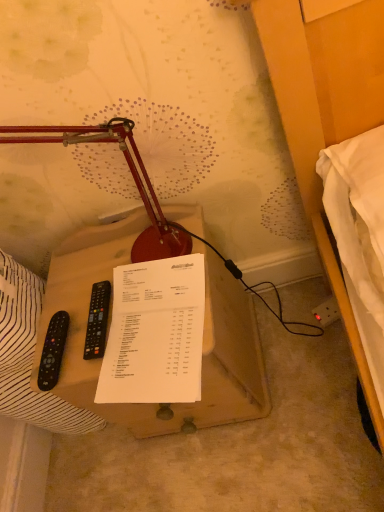
In order to click on free space above wooden table at center (from a real-world perspective) in this screenshot , I will do `click(114, 312)`.